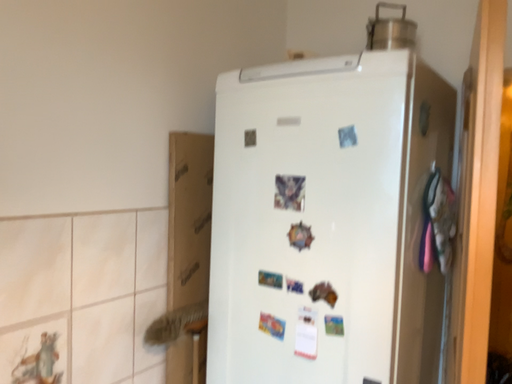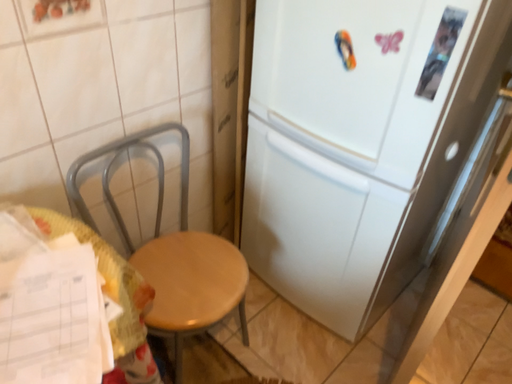
Question: Which way did the camera rotate in the video?

Choices:
 (A) rotated downward
 (B) rotated upward

Answer: (A)